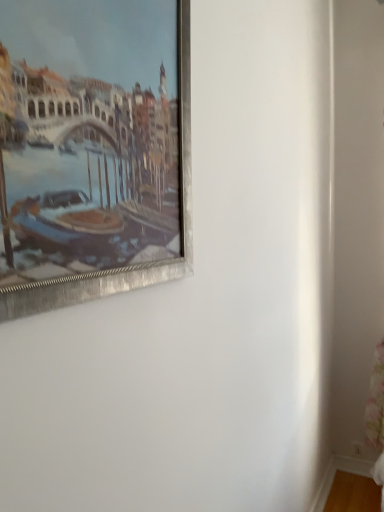
Describe the element at coordinates (132, 266) in the screenshot. I see `metallic silver picture frame at upper left` at that location.

The height and width of the screenshot is (512, 384). I want to click on metallic silver picture frame at upper left, so click(x=132, y=266).

This screenshot has height=512, width=384. I want to click on metallic silver picture frame at upper left, so click(132, 266).